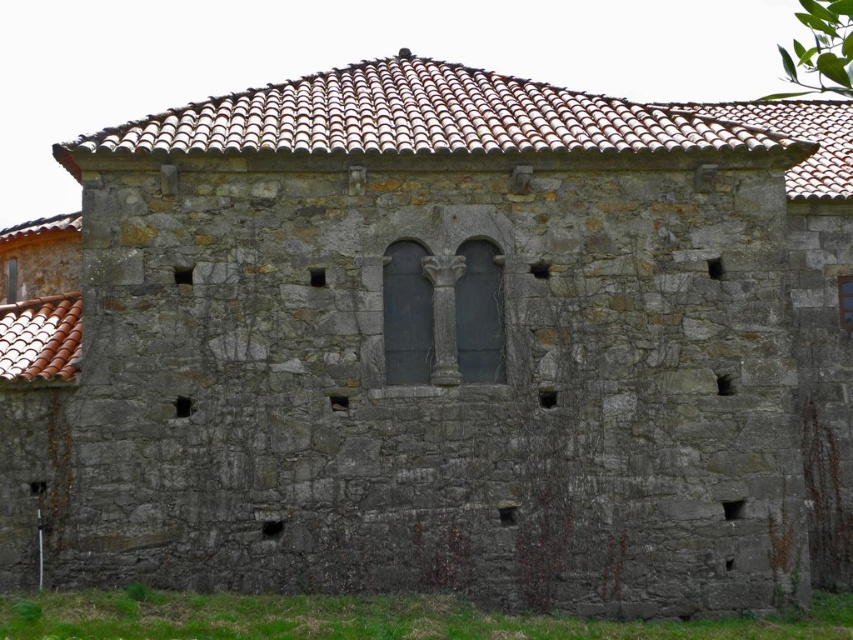
Question: In this image, where is smooth stone column at center located relative to transparent glass window at center?

Choices:
 (A) left
 (B) right

Answer: (A)

Question: Considering the relative positions of smooth stone column at center and transparent glass window at center in the image provided, where is smooth stone column at center located with respect to transparent glass window at center?

Choices:
 (A) left
 (B) right

Answer: (A)

Question: Which point appears closest to the camera in this image?

Choices:
 (A) (850, 324)
 (B) (480, 252)
 (C) (323, 145)

Answer: (C)

Question: Which object appears farthest from the camera in this image?

Choices:
 (A) smooth stone column at center
 (B) transparent glass window at center
 (C) brown clay tiles at upper center

Answer: (B)

Question: Is brown clay tiles at upper center wider than smooth stone column at center?

Choices:
 (A) yes
 (B) no

Answer: (A)

Question: Which point is farther to the camera?

Choices:
 (A) (277, 88)
 (B) (451, 326)
 (C) (849, 314)

Answer: (C)